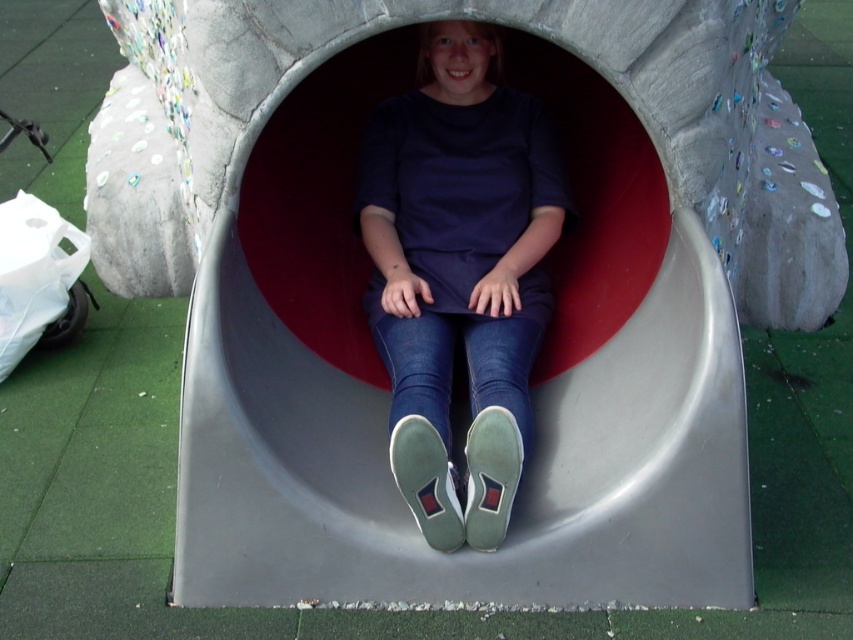
Question: Is smooth plastic slide at center above matte blue jeans at center?

Choices:
 (A) no
 (B) yes

Answer: (A)

Question: Observing the image, what is the correct spatial positioning of smooth plastic slide at center in reference to matte blue jeans at center?

Choices:
 (A) above
 (B) below

Answer: (B)

Question: Is smooth plastic slide at center further to camera compared to matte blue jeans at center?

Choices:
 (A) yes
 (B) no

Answer: (A)

Question: Among these points, which one is nearest to the camera?

Choices:
 (A) (462, 532)
 (B) (196, 488)

Answer: (B)

Question: Among these objects, which one is nearest to the camera?

Choices:
 (A) matte blue jeans at center
 (B) smooth plastic slide at center

Answer: (A)